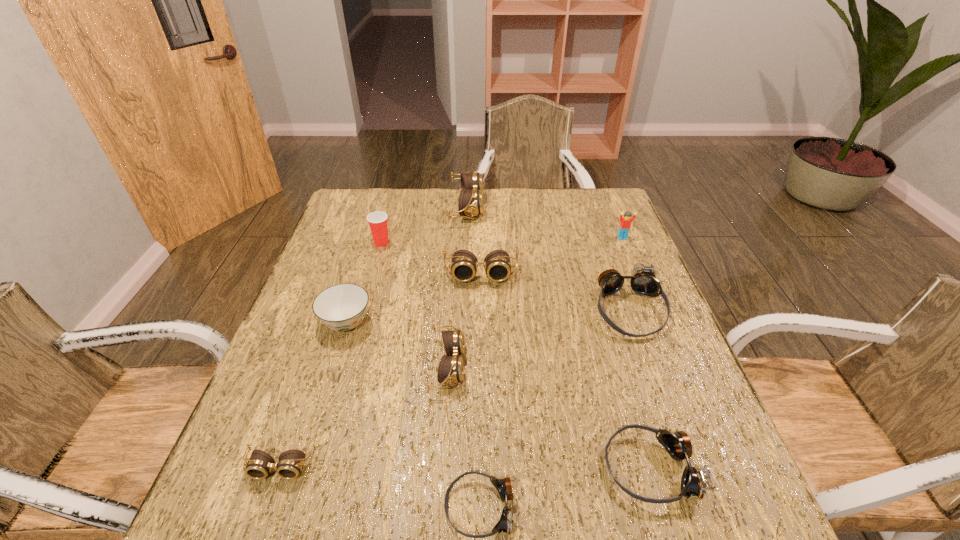
Identify the location of vacant space located through the lenses of the second smallest bronze goggles. The width and height of the screenshot is (960, 540). (500, 468).

Where is `object present at the far edge`? The width and height of the screenshot is (960, 540). object present at the far edge is located at coordinates (470, 203).

This screenshot has height=540, width=960. Identify the location of object present at the near edge. (693, 483).

Locate an element on the screen. The image size is (960, 540). Dixie cup that is at the left edge is located at coordinates (377, 220).

This screenshot has width=960, height=540. In order to click on soup bowl that is at the left edge in this screenshot , I will do `click(342, 307)`.

Locate an element on the screen. goggles present at the left edge is located at coordinates (258, 467).

Identify the location of Lego that is at the right edge. (625, 224).

This screenshot has height=540, width=960. Find the location of `object located in the near right corner section of the desktop`. object located in the near right corner section of the desktop is located at coordinates (693, 483).

I want to click on vacant space at the far edge, so click(400, 188).

Find the location of `vacant area at the near edge of the desktop`. vacant area at the near edge of the desktop is located at coordinates (389, 525).